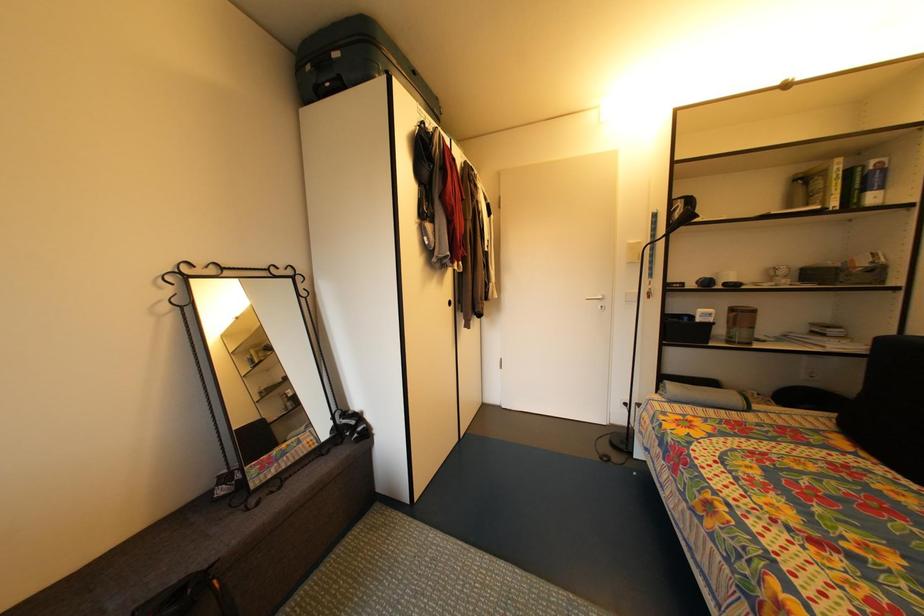
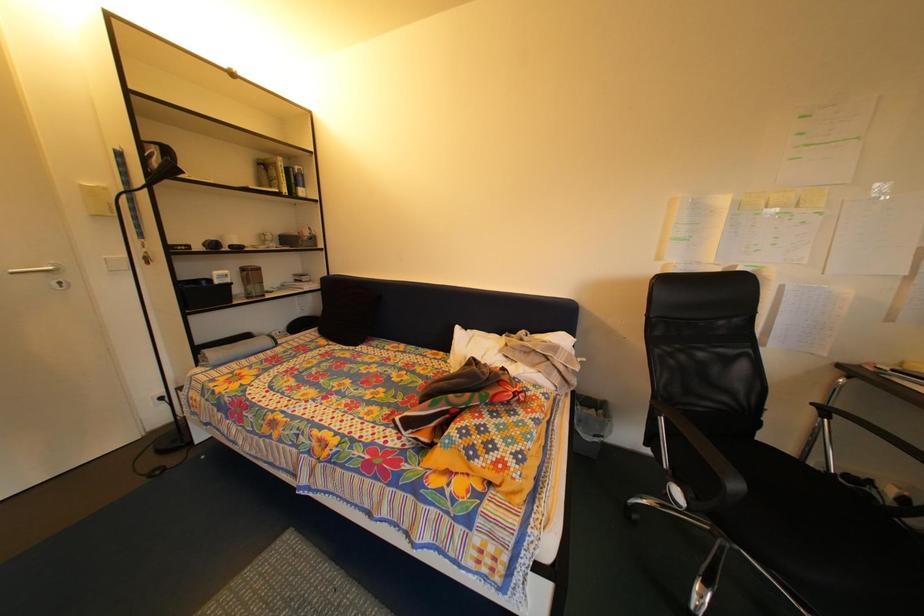
Question: How did the camera likely rotate?

Choices:
 (A) Left
 (B) Right
 (C) Up
 (D) Down

Answer: (B)